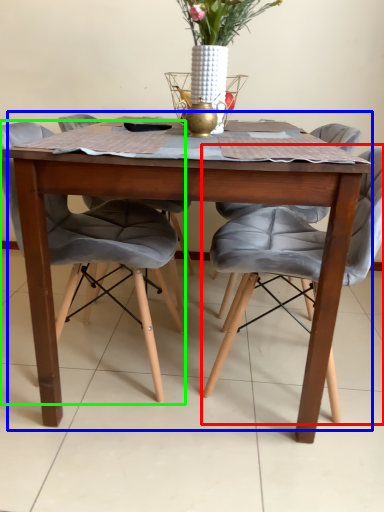
Question: Considering the real-world distances, which object is farthest from chair (highlighted by a red box)? kitchen & dining room table (highlighted by a blue box) or chair (highlighted by a green box)?

Choices:
 (A) kitchen & dining room table
 (B) chair

Answer: (B)